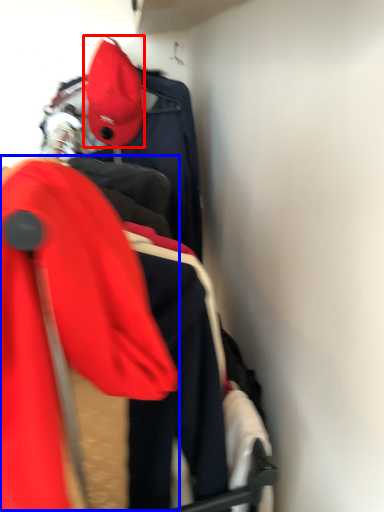
Question: Which point is further to the camera, hat (highlighted by a red box) or ski jacket (highlighted by a blue box)?

Choices:
 (A) hat
 (B) ski jacket

Answer: (A)